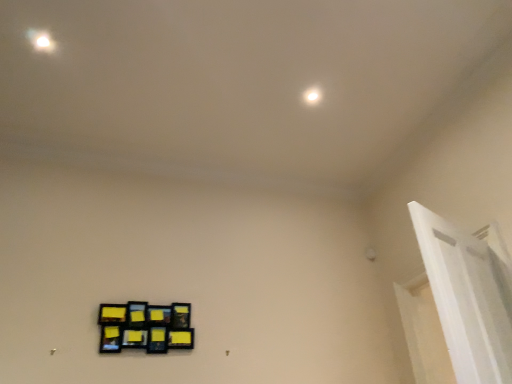
Question: Is black matte picture frame at lower left in front of or behind white glossy light at upper center in the image?

Choices:
 (A) front
 (B) behind

Answer: (A)

Question: Is point (135, 329) closer or farther from the camera than point (311, 100)?

Choices:
 (A) closer
 (B) farther

Answer: (A)

Question: Estimate the real-world distances between objects in this image. Which object is closer to the white glossy door frame at upper right?

Choices:
 (A) black matte picture frame at lower left
 (B) white glossy light at upper center

Answer: (B)

Question: Which is farther from the black matte picture frame at lower left?

Choices:
 (A) white glossy door frame at upper right
 (B) white glossy light at upper center

Answer: (B)